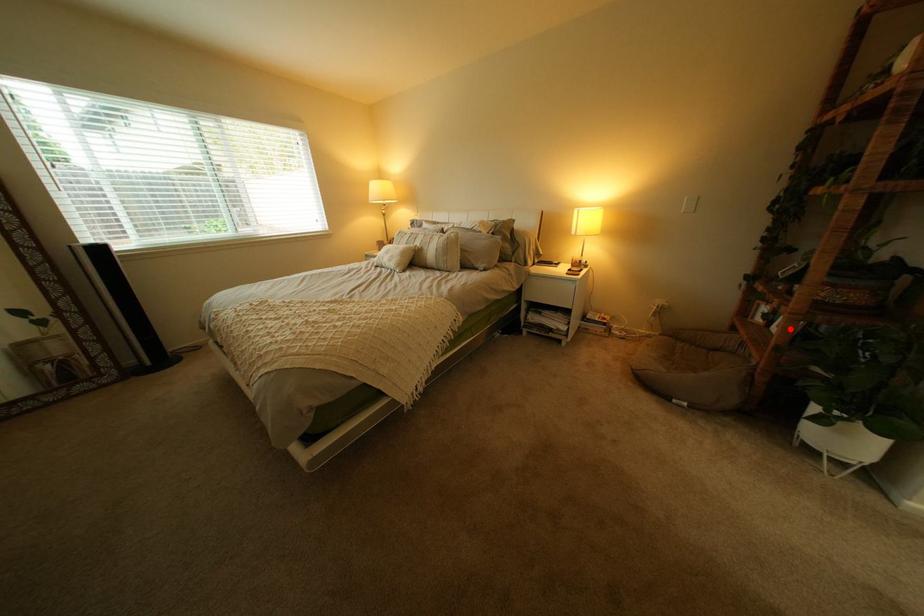
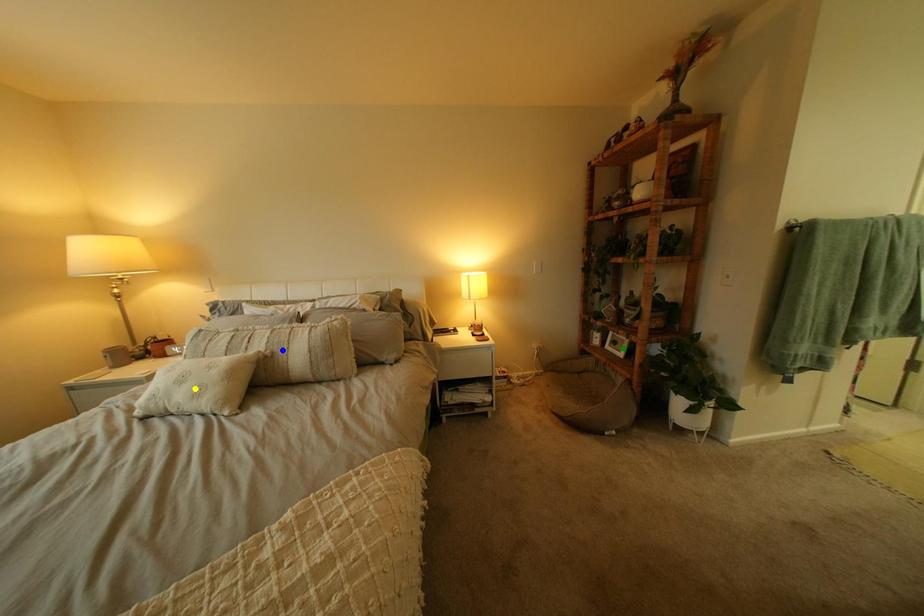
Question: I am providing you with two images of the same scene from different viewpoints. A red point is marked on the first image. You are given multiple points on the second image. Can you choose the point in image 2 that corresponds to the point in image 1?

Choices:
 (A) blue point
 (B) yellow point
 (C) green point

Answer: (C)